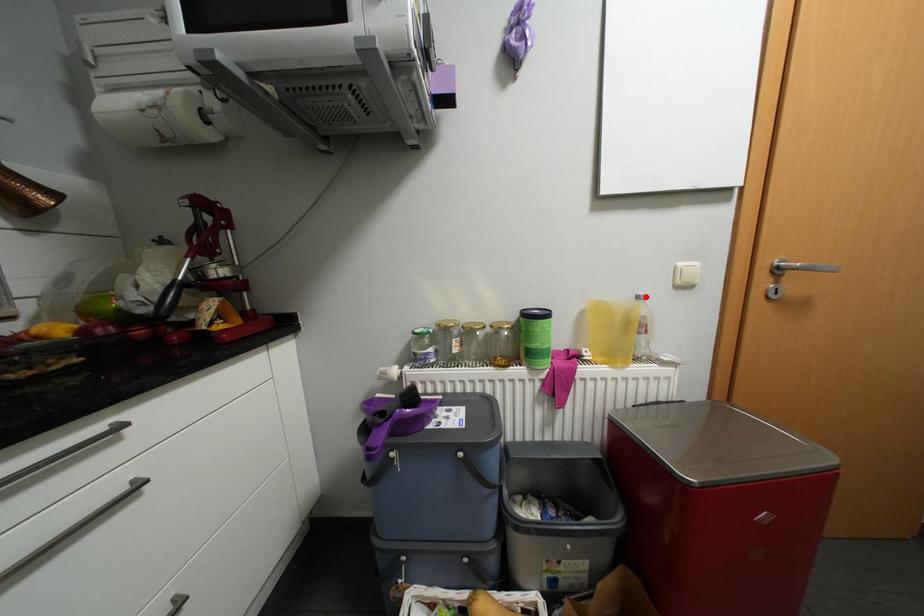
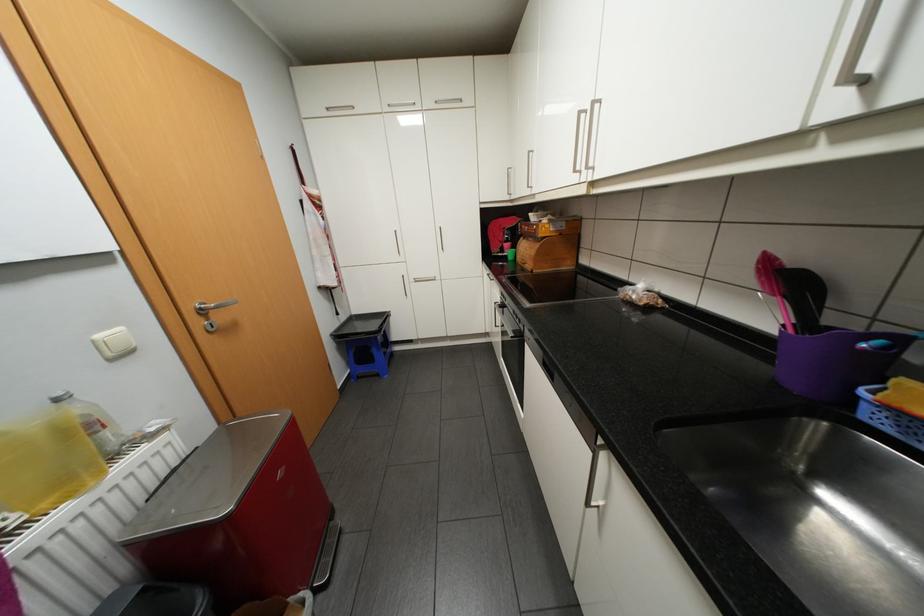
Question: I am providing you with two images of the same scene from different viewpoints. A red point is marked on the first image. Can you still see the location of the red point in image 2?

Choices:
 (A) Yes
 (B) No

Answer: (A)